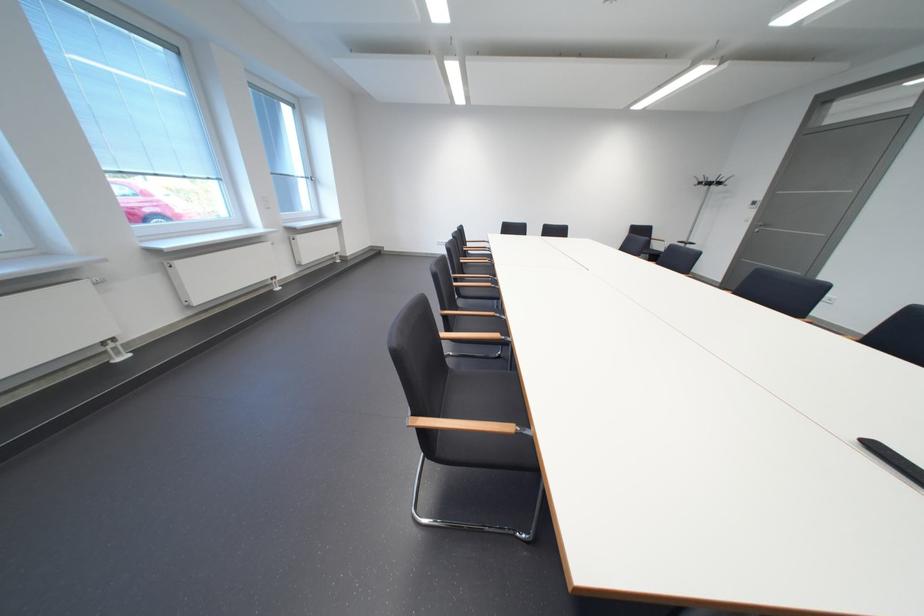
Where would you hang the coat stand hook? Please return your answer as a coordinate pair (x, y).

(711, 180)